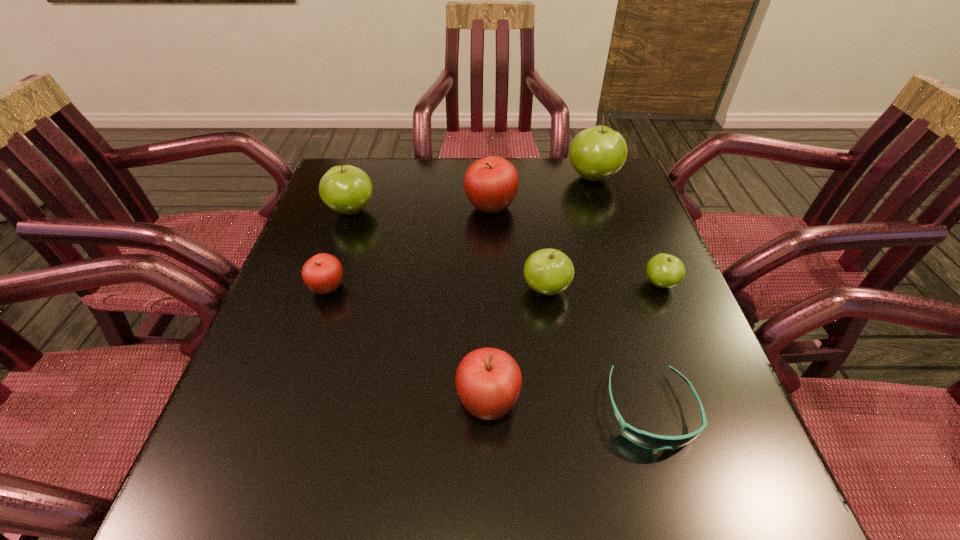
Where is `free space between the leftmost red apple and the smallest green apple`? The image size is (960, 540). free space between the leftmost red apple and the smallest green apple is located at coordinates (494, 286).

Find the location of `vacant area that lies between the smallest green apple and the leftmost red apple`. vacant area that lies between the smallest green apple and the leftmost red apple is located at coordinates (494, 286).

Where is `vacant space that's between the second smallest green apple and the smallest green apple`? The image size is (960, 540). vacant space that's between the second smallest green apple and the smallest green apple is located at coordinates (603, 286).

I want to click on unoccupied position between the second smallest green apple and the smallest green apple, so click(603, 286).

The height and width of the screenshot is (540, 960). Identify the location of empty location between the third green apple from right to left and the biggest red apple. [518, 248].

At what (x,y) coordinates should I click in order to perform the action: click on empty location between the second green apple from left to right and the farthest green apple. Please return your answer as a coordinate pair (x, y). The image size is (960, 540). Looking at the image, I should click on (569, 233).

Find the location of a particular element. free space between the cyan sunglasses and the smallest green apple is located at coordinates (656, 347).

Find the location of `object that can be found as the sixth closest to the second farthest green apple`. object that can be found as the sixth closest to the second farthest green apple is located at coordinates (664, 270).

Locate which object is the sixth closest to the cyan sunglasses. Please provide its 2D coordinates. Your answer should be formatted as a tuple, i.e. [(x, y)], where the tuple contains the x and y coordinates of a point satisfying the conditions above.

[(596, 153)]

Select which apple is the sixth closest to the nearest apple. Please provide its 2D coordinates. Your answer should be formatted as a tuple, i.e. [(x, y)], where the tuple contains the x and y coordinates of a point satisfying the conditions above.

[(596, 153)]